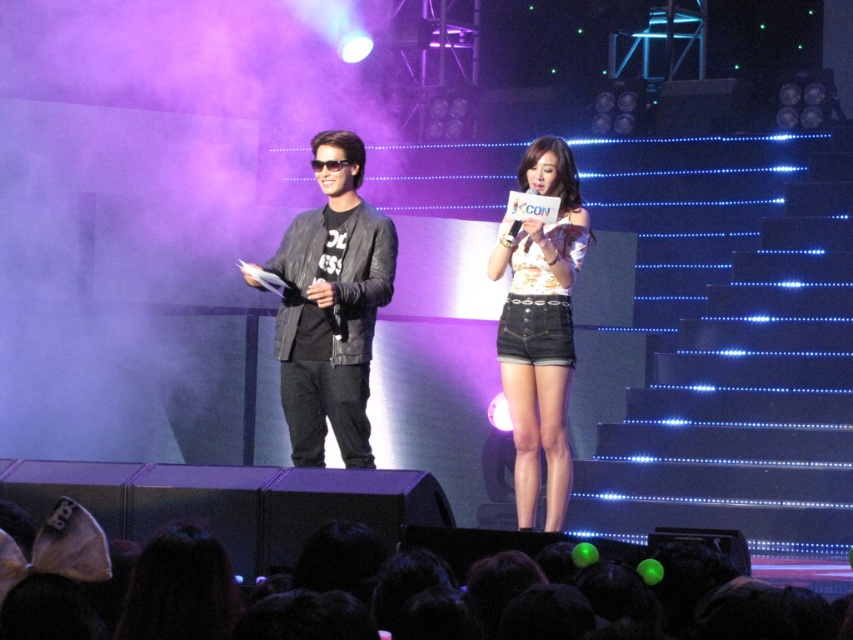
You are a photographer at the KCON event and need to capture a photo of the denim shorts at center and floral fabric top at center. Which clothing item should you focus on first if you want to capture the taller one?

The floral fabric top at center is taller than the denim shorts at center, so you should focus on the floral fabric top at center first.

You are a costume designer observing the stage performance at KCON. You need to determine which clothing item is shorter between the leather jacket at center and the floral fabric top at center. Which one is shorter?

The leather jacket at center has a lesser height compared to the floral fabric top at center, so the leather jacket at center is shorter.

You are a photographer at the KCON event and want to capture a photo that includes both the man on the left and the microphone with the KCON logo. The man is at point (341, 273) and the microphone is at point (527, 518). Which of these points is closer to the camera to ensure both subjects are in focus?

Point (341, 273) is closer to the camera than point (527, 518), so focusing on the man first will help keep both in focus since he is nearer.